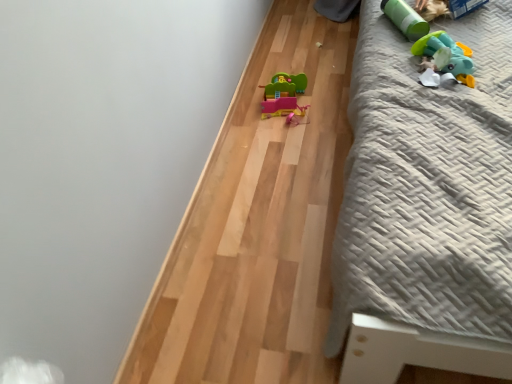
Question: Do you think matte plastic toy car at center, which is the 1th toy in back-to-front order, is within green matte cylinder at upper right, acting as the second toy starting from the back, or outside of it?

Choices:
 (A) outside
 (B) inside

Answer: (A)

Question: From the image's perspective, is matte plastic toy car at center, the third toy from the front, located above or below green matte cylinder at upper right, which is counted as the 2th toy, starting from the right?

Choices:
 (A) below
 (B) above

Answer: (A)

Question: Based on their relative distances, which object is farther from the rubber duck at upper right, which is counted as the first toy, starting from the front?

Choices:
 (A) green matte cylinder at upper right, acting as the second toy starting from the back
 (B) gray textured bed at right
 (C) matte plastic toy car at center, arranged as the third toy when viewed from the right

Answer: (C)

Question: Estimate the real-world distances between objects in this image. Which object is farther from the green matte cylinder at upper right, acting as the 2th toy starting from the left?

Choices:
 (A) rubber duck at upper right, which ranks as the 1th toy in right-to-left order
 (B) matte plastic toy car at center, arranged as the third toy when viewed from the right
 (C) gray textured bed at right

Answer: (B)